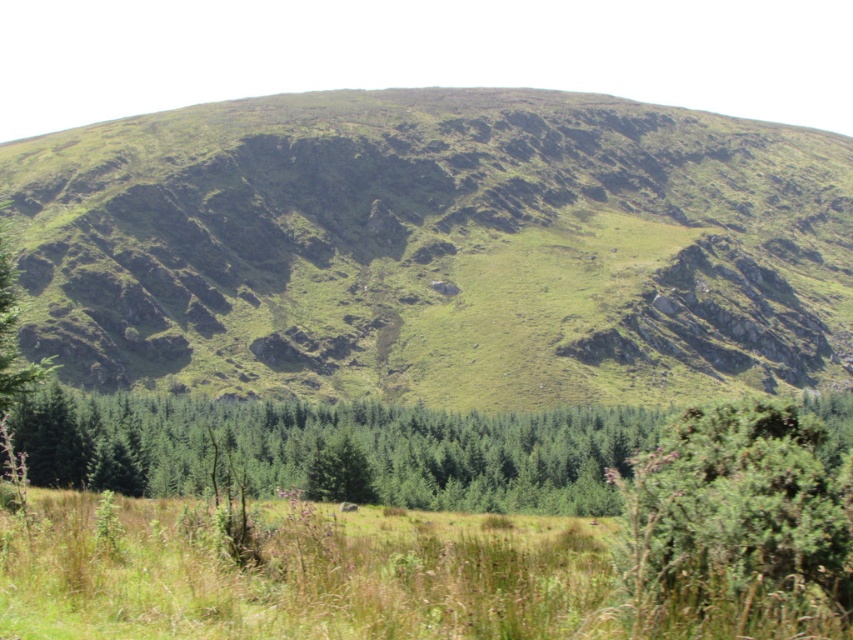
Consider the image. Who is higher up, green grassy hill at center or green leafy bush at lower right?

green grassy hill at center

Between green grassy hill at center and green leafy bush at lower right, which one has more height?

green grassy hill at center

Does point (680, 278) come closer to viewer compared to point (637, 508)?

No, it is not.

In order to click on green grassy hill at center in this screenshot , I will do `click(437, 250)`.

Can you confirm if green grassy field at lower center is positioned below green leafy bush at lower right?

Indeed, green grassy field at lower center is positioned under green leafy bush at lower right.

Between point (581, 620) and point (695, 449), which one is positioned in front?

Positioned in front is point (581, 620).

Who is more forward, (x=572, y=534) or (x=676, y=429)?

Point (x=676, y=429) is more forward.

This screenshot has width=853, height=640. I want to click on green grassy field at lower center, so pyautogui.click(x=329, y=576).

From the picture: Does green matte trees at center appear over green leafy bush at lower right?

Incorrect, green matte trees at center is not positioned above green leafy bush at lower right.

Who is lower down, green matte trees at center or green leafy bush at lower right?

green matte trees at center is lower down.

Between point (54, 481) and point (614, 474), which one is positioned behind?

The point (54, 481) is more distant.

This screenshot has width=853, height=640. I want to click on green matte trees at center, so click(x=334, y=449).